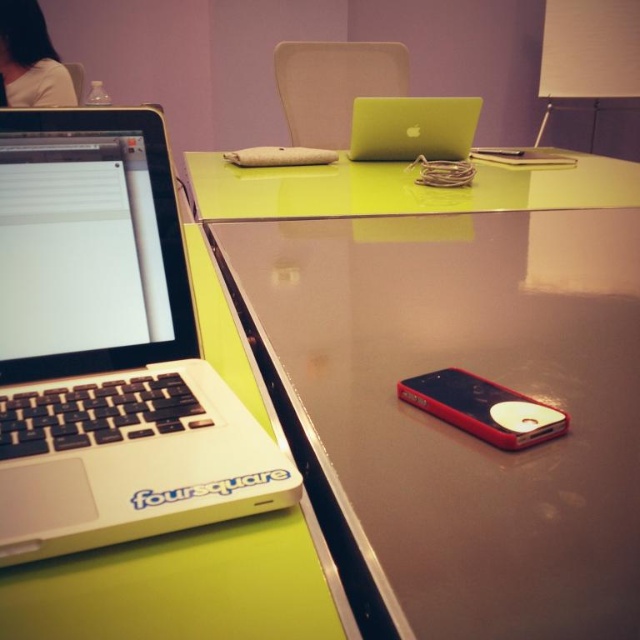
Does matte white lampshade at upper right appear on the right side of red plastic phone at lower right?

Yes, matte white lampshade at upper right is to the right of red plastic phone at lower right.

Is the position of matte white lampshade at upper right less distant than that of red plastic phone at lower right?

No, it is not.

At what (x,y) coordinates should I click in order to perform the action: click on matte white lampshade at upper right. Please return your answer as a coordinate pair (x, y). Looking at the image, I should click on (588, 51).

Is white matte laptop at left thinner than matte white lampshade at upper right?

Indeed, white matte laptop at left has a lesser width compared to matte white lampshade at upper right.

What do you see at coordinates (108, 348) in the screenshot? I see `white matte laptop at left` at bounding box center [108, 348].

I want to click on white matte laptop at left, so click(x=108, y=348).

Does white matte laptop at left have a lesser height compared to green glossy table at center?

Yes, white matte laptop at left is shorter than green glossy table at center.

Can you confirm if white matte laptop at left is positioned to the left of green glossy table at center?

Correct, you'll find white matte laptop at left to the left of green glossy table at center.

I want to click on white matte laptop at left, so [108, 348].

Locate an element on the screen. Image resolution: width=640 pixels, height=640 pixels. white matte laptop at left is located at coordinates (108, 348).